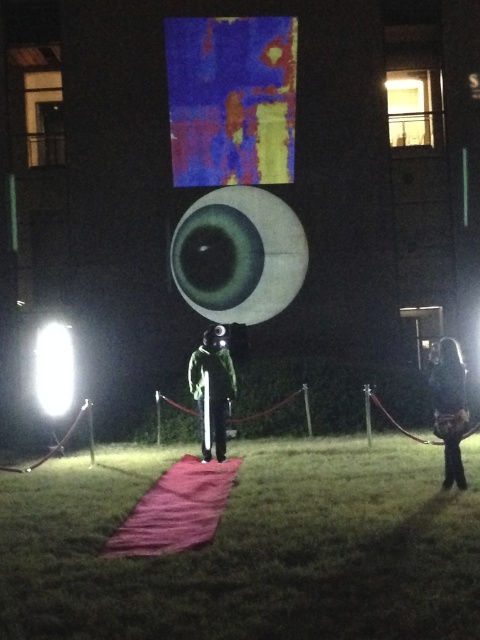
You are an event organizer setting up a photo booth. You need to place a backdrop that is larger than the dark fabric coat at lower right but smaller than the white glossy light at left. Is this possible given their sizes?

The dark fabric coat at lower right is smaller than the white glossy light at left. Since the backdrop needs to be larger than the dark fabric coat at lower right but smaller than the white glossy light at left, it is possible to choose a size that fits between them.

You are an event planner setting up for a gala. You have a decorative item that requires a large space. You see the green grass at center and the white glossy light at left. Which object would you choose to place the item next to, and why?

You should place the decorative item next to the white glossy light at left because it has a larger size compared to the green grass at center, providing more space for the item.

You are standing at the entrance of the event and want to take a photo of the green fabric suit at center without including the sculpture. Which direction should you move to ensure the sculpture is out of frame?

Move to the left or right of the green fabric suit at center to position the sculpture out of the camera frame.